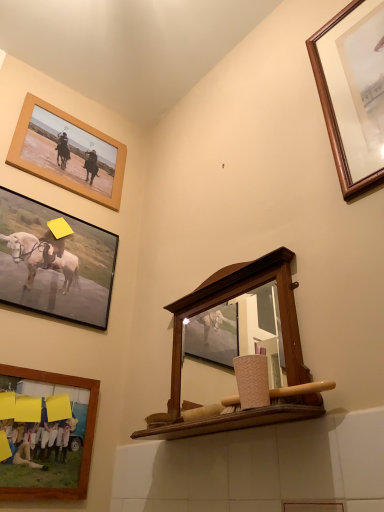
In order to face wooden frame at upper left, marked as the first picture frame in a left-to-right arrangement, should I rotate leftwards or rightwards?

Turn left by 15.390 degrees to look at wooden frame at upper left, marked as the first picture frame in a left-to-right arrangement.

In order to face wooden-framed picture at lower left, the 2th picture frame viewed from the right, should I rotate leftwards or rightwards?

A 18.877 degree turn to the left will do.

The height and width of the screenshot is (512, 384). Find the location of `wooden-framed picture at lower left, the 2th picture frame viewed from the right`. wooden-framed picture at lower left, the 2th picture frame viewed from the right is located at coordinates (84, 439).

I want to click on matte black frame at upper left, which appears as the third picture frame when viewed from the right, so click(x=54, y=263).

Image resolution: width=384 pixels, height=512 pixels. Describe the element at coordinates (237, 296) in the screenshot. I see `wooden mirror at center` at that location.

Identify the location of wooden mirror at center. This screenshot has width=384, height=512. (237, 296).

Identify the location of wooden frame at upper left, marked as the first picture frame in a left-to-right arrangement. (69, 150).

Consider the image. Does wooden frame at upper left, which is the fourth picture frame in right-to-left order, have a lesser width compared to wooden mirror at center?

Indeed, wooden frame at upper left, which is the fourth picture frame in right-to-left order, has a lesser width compared to wooden mirror at center.

Is wooden frame at upper left, marked as the first picture frame in a left-to-right arrangement, bigger or smaller than wooden mirror at center?

Clearly, wooden frame at upper left, marked as the first picture frame in a left-to-right arrangement, is smaller in size than wooden mirror at center.

Based on the photo, is wooden frame at upper left, marked as the first picture frame in a left-to-right arrangement, not within wooden mirror at center?

Yes, wooden frame at upper left, marked as the first picture frame in a left-to-right arrangement, is located beyond the bounds of wooden mirror at center.

Which object is closer to the camera taking this photo, wooden frame at upper left, which is the fourth picture frame in right-to-left order, or wooden mirror at center?

wooden mirror at center.

Considering the relative sizes of wooden picture frame at upper right, the fourth picture frame in the left-to-right sequence, and wooden frame at upper left, marked as the first picture frame in a left-to-right arrangement, in the image provided, is wooden picture frame at upper right, the fourth picture frame in the left-to-right sequence, shorter than wooden frame at upper left, marked as the first picture frame in a left-to-right arrangement,?

No.

Image resolution: width=384 pixels, height=512 pixels. I want to click on picture frame above the wooden frame at upper left, marked as the first picture frame in a left-to-right arrangement (from the image's perspective), so click(353, 92).

Which is nearer, (364, 87) or (37, 166)?

Point (364, 87).

Can you see wooden picture frame at upper right, which is counted as the first picture frame, starting from the right, touching wooden frame at upper left, which is the fourth picture frame in right-to-left order?

No, wooden picture frame at upper right, which is counted as the first picture frame, starting from the right, is not touching wooden frame at upper left, which is the fourth picture frame in right-to-left order.

This screenshot has height=512, width=384. I want to click on picture frame lying below the wooden mirror at center (from the image's perspective), so click(84, 439).

Which of these two, wooden-framed picture at lower left, the third picture frame positioned from the left, or wooden mirror at center, is bigger?

wooden mirror at center.

From a real-world perspective, is wooden-framed picture at lower left, the 2th picture frame viewed from the right, positioned above or below wooden mirror at center?

Clearly, from a real-world perspective, wooden-framed picture at lower left, the 2th picture frame viewed from the right, is below wooden mirror at center.

Between wooden frame at upper left, which is the fourth picture frame in right-to-left order, and matte black frame at upper left, which appears as the third picture frame when viewed from the right, which one is positioned in front?

matte black frame at upper left, which appears as the third picture frame when viewed from the right, is in front.

Where is `picture frame that is the 2nd one above the matte black frame at upper left, which ranks as the second picture frame in left-to-right order (from a real-world perspective)`? picture frame that is the 2nd one above the matte black frame at upper left, which ranks as the second picture frame in left-to-right order (from a real-world perspective) is located at coordinates (69, 150).

Considering the sizes of objects wooden frame at upper left, which is the fourth picture frame in right-to-left order, and matte black frame at upper left, which ranks as the second picture frame in left-to-right order, in the image provided, who is smaller, wooden frame at upper left, which is the fourth picture frame in right-to-left order, or matte black frame at upper left, which ranks as the second picture frame in left-to-right order,?

wooden frame at upper left, which is the fourth picture frame in right-to-left order.

Does wooden frame at upper left, which is the fourth picture frame in right-to-left order, touch matte black frame at upper left, which ranks as the second picture frame in left-to-right order?

No, wooden frame at upper left, which is the fourth picture frame in right-to-left order, is not with matte black frame at upper left, which ranks as the second picture frame in left-to-right order.

Is wooden-framed picture at lower left, the 2th picture frame viewed from the right, not near matte black frame at upper left, which ranks as the second picture frame in left-to-right order?

No, wooden-framed picture at lower left, the 2th picture frame viewed from the right, is in close proximity to matte black frame at upper left, which ranks as the second picture frame in left-to-right order.

Relative to matte black frame at upper left, which ranks as the second picture frame in left-to-right order, is wooden-framed picture at lower left, the third picture frame positioned from the left, in front or behind?

wooden-framed picture at lower left, the third picture frame positioned from the left, is in front of matte black frame at upper left, which ranks as the second picture frame in left-to-right order.

Consider the image. Considering the sizes of wooden-framed picture at lower left, the third picture frame positioned from the left, and matte black frame at upper left, which appears as the third picture frame when viewed from the right, in the image, is wooden-framed picture at lower left, the third picture frame positioned from the left, bigger or smaller than matte black frame at upper left, which appears as the third picture frame when viewed from the right,?

Clearly, wooden-framed picture at lower left, the third picture frame positioned from the left, is smaller in size than matte black frame at upper left, which appears as the third picture frame when viewed from the right.

Starting from the wooden frame at upper left, marked as the first picture frame in a left-to-right arrangement, which picture frame is the 3rd one in front? Please provide its 2D coordinates.

[(353, 92)]

Does point (35, 146) appear closer or farther from the camera than point (344, 137)?

Clearly, point (35, 146) is more distant from the camera than point (344, 137).

Between wooden frame at upper left, marked as the first picture frame in a left-to-right arrangement, and wooden picture frame at upper right, which is counted as the first picture frame, starting from the right, which one is positioned behind?

wooden frame at upper left, marked as the first picture frame in a left-to-right arrangement, is behind.

Is wooden frame at upper left, which is the fourth picture frame in right-to-left order, bigger or smaller than wooden picture frame at upper right, which is counted as the first picture frame, starting from the right?

Clearly, wooden frame at upper left, which is the fourth picture frame in right-to-left order, is smaller in size than wooden picture frame at upper right, which is counted as the first picture frame, starting from the right.

Which object is further away from the camera taking this photo, wooden mirror at center or wooden frame at upper left, marked as the first picture frame in a left-to-right arrangement?

Positioned behind is wooden frame at upper left, marked as the first picture frame in a left-to-right arrangement.

Considering the relative positions of wooden mirror at center and wooden frame at upper left, marked as the first picture frame in a left-to-right arrangement, in the image provided, is wooden mirror at center to the left or to the right of wooden frame at upper left, marked as the first picture frame in a left-to-right arrangement,?

From the image, it's evident that wooden mirror at center is to the right of wooden frame at upper left, marked as the first picture frame in a left-to-right arrangement.

Who is taller, wooden mirror at center or wooden frame at upper left, which is the fourth picture frame in right-to-left order?

wooden mirror at center is taller.

Locate an element on the screen. The width and height of the screenshot is (384, 512). mirror in front of the wooden frame at upper left, marked as the first picture frame in a left-to-right arrangement is located at coordinates (237, 296).

In order to click on picture frame above the wooden picture frame at upper right, the fourth picture frame in the left-to-right sequence (from a real-world perspective) in this screenshot , I will do `click(69, 150)`.

Looking at the image, which one is located closer to wooden picture frame at upper right, which is counted as the first picture frame, starting from the right, wooden mirror at center or wooden frame at upper left, which is the fourth picture frame in right-to-left order?

wooden mirror at center lies closer to wooden picture frame at upper right, which is counted as the first picture frame, starting from the right, than the other object.

When comparing their distances from wooden mirror at center, does wooden-framed picture at lower left, the 2th picture frame viewed from the right, or wooden frame at upper left, which is the fourth picture frame in right-to-left order, seem further?

wooden frame at upper left, which is the fourth picture frame in right-to-left order, is further to wooden mirror at center.

From the image, which object appears to be nearer to wooden picture frame at upper right, the fourth picture frame in the left-to-right sequence, wooden frame at upper left, marked as the first picture frame in a left-to-right arrangement, or wooden mirror at center?

Among the two, wooden mirror at center is located nearer to wooden picture frame at upper right, the fourth picture frame in the left-to-right sequence.

From the image, which object appears to be nearer to matte black frame at upper left, which appears as the third picture frame when viewed from the right, wooden picture frame at upper right, the fourth picture frame in the left-to-right sequence, or wooden mirror at center?

wooden mirror at center is positioned closer to the anchor matte black frame at upper left, which appears as the third picture frame when viewed from the right.

Looking at this image, considering their positions, is wooden-framed picture at lower left, the third picture frame positioned from the left, positioned further to wooden mirror at center than wooden picture frame at upper right, which is counted as the first picture frame, starting from the right?

wooden-framed picture at lower left, the third picture frame positioned from the left, is positioned further to the anchor wooden mirror at center.

Based on their spatial positions, is wooden picture frame at upper right, the fourth picture frame in the left-to-right sequence, or wooden-framed picture at lower left, the third picture frame positioned from the left, closer to wooden frame at upper left, marked as the first picture frame in a left-to-right arrangement?

Based on the image, wooden-framed picture at lower left, the third picture frame positioned from the left, appears to be nearer to wooden frame at upper left, marked as the first picture frame in a left-to-right arrangement.

In the scene shown: Based on their spatial positions, is wooden frame at upper left, which is the fourth picture frame in right-to-left order, or matte black frame at upper left, which appears as the third picture frame when viewed from the right, closer to wooden-framed picture at lower left, the 2th picture frame viewed from the right?

The object closer to wooden-framed picture at lower left, the 2th picture frame viewed from the right, is matte black frame at upper left, which appears as the third picture frame when viewed from the right.

When comparing their distances from wooden frame at upper left, which is the fourth picture frame in right-to-left order, does matte black frame at upper left, which appears as the third picture frame when viewed from the right, or wooden mirror at center seem closer?

Among the two, matte black frame at upper left, which appears as the third picture frame when viewed from the right, is located nearer to wooden frame at upper left, which is the fourth picture frame in right-to-left order.

Where is `picture frame located between matte black frame at upper left, which ranks as the second picture frame in left-to-right order, and wooden picture frame at upper right, which is counted as the first picture frame, starting from the right, in the left-right direction`? This screenshot has height=512, width=384. picture frame located between matte black frame at upper left, which ranks as the second picture frame in left-to-right order, and wooden picture frame at upper right, which is counted as the first picture frame, starting from the right, in the left-right direction is located at coordinates (84, 439).

You are a GUI agent. You are given a task and a screenshot of the screen. Output one action in this format:
    pyautogui.click(x=<x>, y=<y>)
    Task: Click on the picture frame between wooden frame at upper left, marked as the first picture frame in a left-to-right arrangement, and wooden-framed picture at lower left, the third picture frame positioned from the left, in the up-down direction
    The image size is (384, 512).
    Given the screenshot: What is the action you would take?
    pyautogui.click(x=54, y=263)

You are a GUI agent. You are given a task and a screenshot of the screen. Output one action in this format:
    pyautogui.click(x=<x>, y=<y>)
    Task: Click on the mirror between wooden frame at upper left, marked as the first picture frame in a left-to-right arrangement, and wooden-framed picture at lower left, the 2th picture frame viewed from the right, vertically
    
    Given the screenshot: What is the action you would take?
    pyautogui.click(x=237, y=296)

Locate an element on the screen. mirror between matte black frame at upper left, which appears as the third picture frame when viewed from the right, and wooden picture frame at upper right, which is counted as the first picture frame, starting from the right, from left to right is located at coordinates point(237,296).